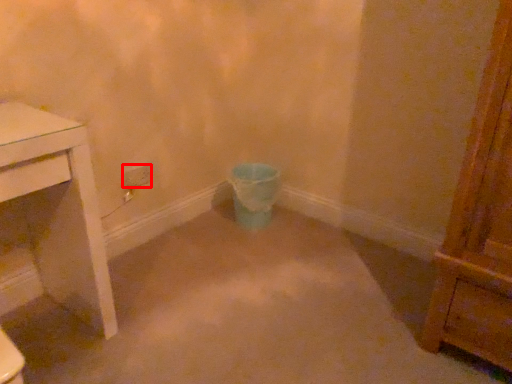
Question: From the image's perspective, considering the relative positions of power plugs and sockets (annotated by the red box) and toilet bowl in the image provided, where is power plugs and sockets (annotated by the red box) located with respect to the staircase?

Choices:
 (A) below
 (B) above

Answer: (B)